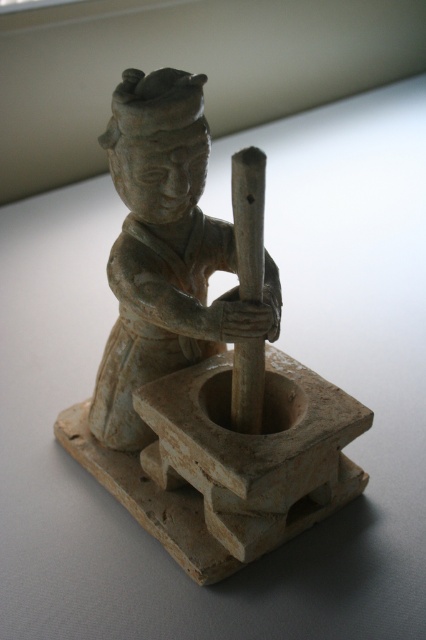
Question: Which point is farther to the camera?

Choices:
 (A) (143, 272)
 (B) (118, 404)

Answer: (B)

Question: Which object appears closest to the camera in this image?

Choices:
 (A) grayish-white ceramic figure at center
 (B) beige ceramic statue at center

Answer: (B)

Question: Which point is closer to the camera?

Choices:
 (A) grayish-white ceramic figure at center
 (B) beige ceramic statue at center

Answer: (B)

Question: Can you confirm if beige ceramic statue at center is positioned to the right of grayish-white ceramic figure at center?

Choices:
 (A) no
 (B) yes

Answer: (A)

Question: Observing the image, what is the correct spatial positioning of beige ceramic statue at center in reference to grayish-white ceramic figure at center?

Choices:
 (A) left
 (B) right

Answer: (A)

Question: Does beige ceramic statue at center have a larger size compared to grayish-white ceramic figure at center?

Choices:
 (A) no
 (B) yes

Answer: (B)